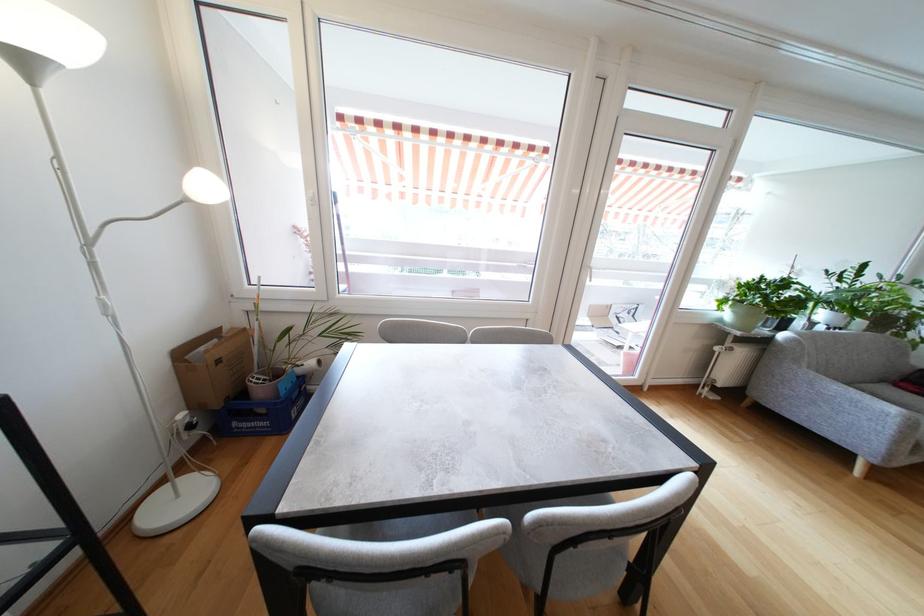
Find where to turn the white radiator valve. Please return your answer as a coordinate pair (x, y).

(724, 365)